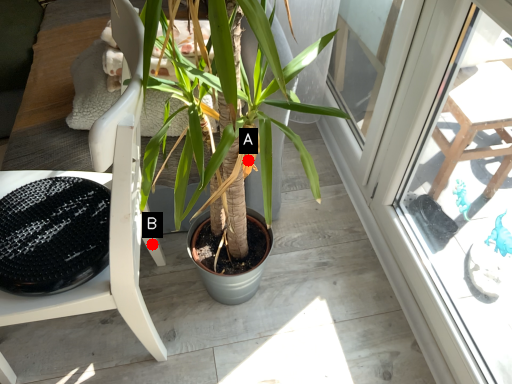
Question: Two points are circled on the image, labeled by A and B beside each circle. Which point is farther to the camera?

Choices:
 (A) A is further
 (B) B is further

Answer: (B)